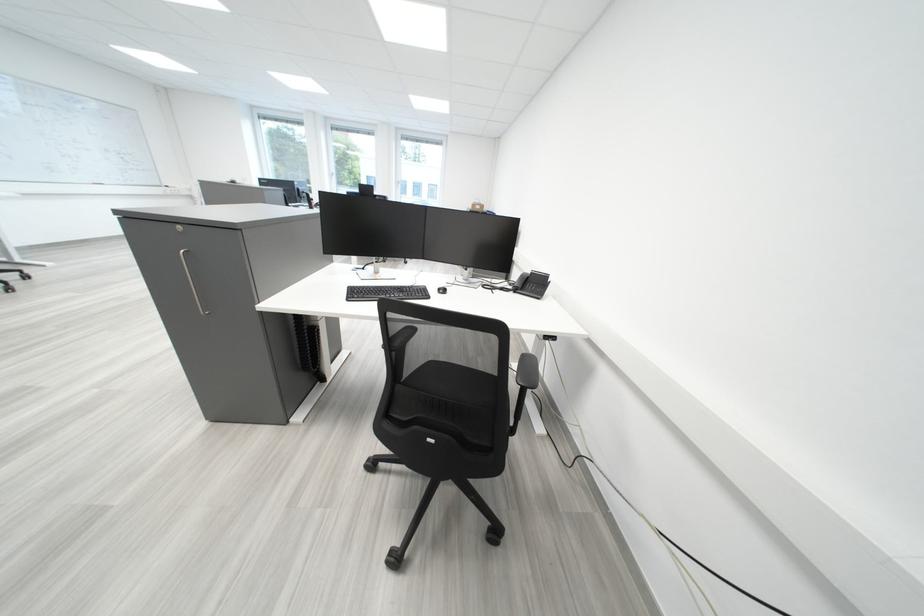
The width and height of the screenshot is (924, 616). What do you see at coordinates (527, 371) in the screenshot? I see `the black chair armrest` at bounding box center [527, 371].